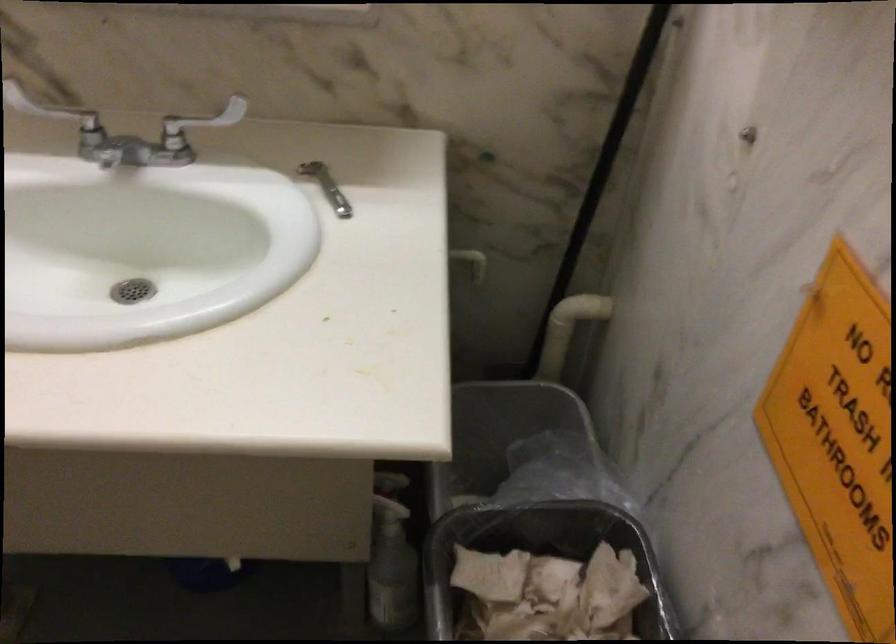
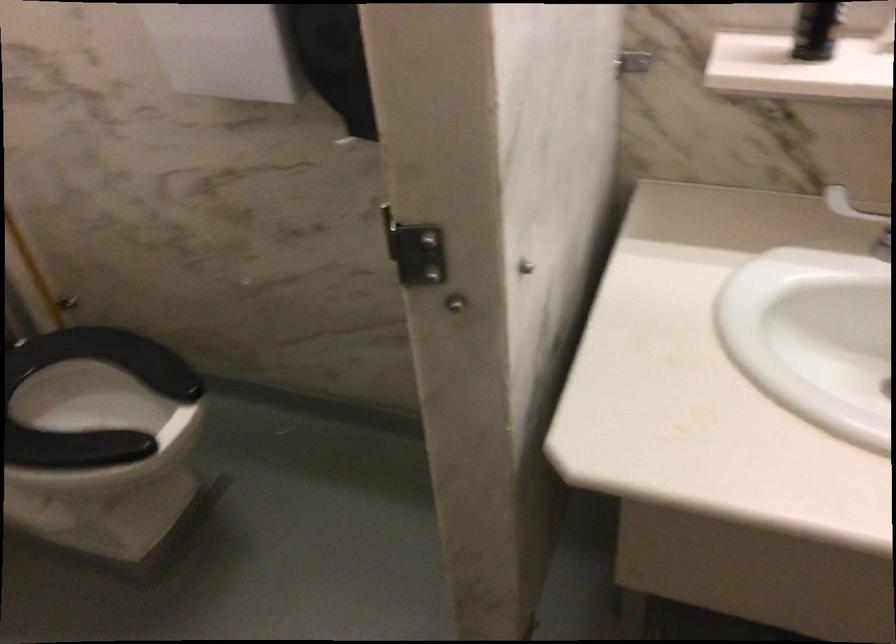
Question: The camera is either moving clockwise (left) or counter-clockwise (right) around the object. The first image is from the beginning of the video and the second image is from the end. Is the camera moving left or right when shooting the video?

Choices:
 (A) Left
 (B) Right

Answer: (B)